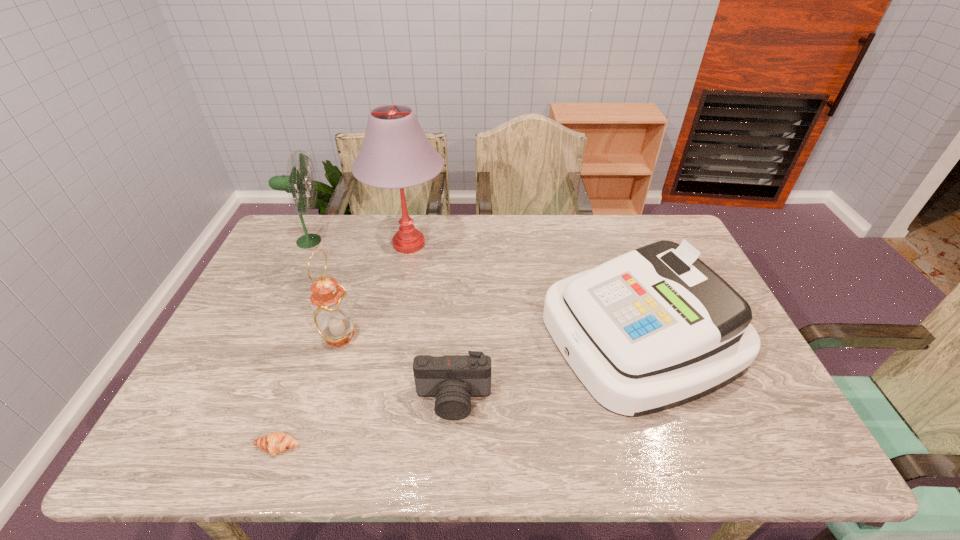
Where is `table lamp`? table lamp is located at coordinates (395, 154).

In order to click on the leftmost object in this screenshot , I will do `click(296, 182)`.

This screenshot has width=960, height=540. I want to click on oil lamp, so click(331, 312).

At what (x,y) coordinates should I click in order to perform the action: click on cash register. Please return your answer as a coordinate pair (x, y). The height and width of the screenshot is (540, 960). Looking at the image, I should click on pos(655,328).

Locate an element on the screen. the third shortest object is located at coordinates (655, 328).

Find the location of a particular element. The width and height of the screenshot is (960, 540). the second shortest object is located at coordinates click(452, 379).

Where is `the shortest object`? The width and height of the screenshot is (960, 540). the shortest object is located at coordinates (276, 442).

Image resolution: width=960 pixels, height=540 pixels. Find the location of `pastry`. pastry is located at coordinates (276, 442).

Where is `vacant space situated 0.120m on the front-facing side of the table lamp`? vacant space situated 0.120m on the front-facing side of the table lamp is located at coordinates (484, 244).

Where is `free space located on the front-facing side of the leftmost object`? The width and height of the screenshot is (960, 540). free space located on the front-facing side of the leftmost object is located at coordinates (367, 241).